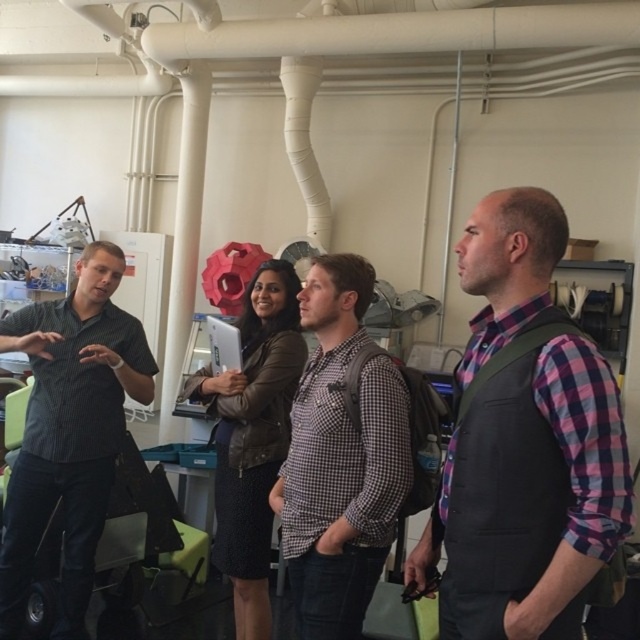
You are an engineer in the workshop and need to locate the plaid fabric shirt at center. Where exactly is it positioned in the image?

The plaid fabric shirt at center is located at point (524, 442) in the image.

You are standing in the workshop and need to locate the plaid fabric shirt at center. According to the coordinates provided, where exactly is it positioned?

The plaid fabric shirt at center is located at point 0.692 on the x and 0.820 on the y axis.